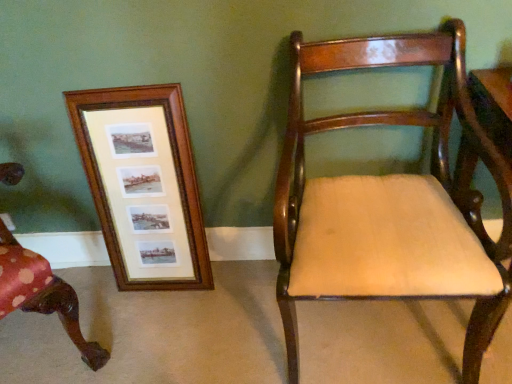
This screenshot has height=384, width=512. I want to click on free area in between wooden chair at left, marked as the first chair in a left-to-right arrangement, and mahogany wood chair at right, which is the 2th chair from left to right, so click(x=185, y=321).